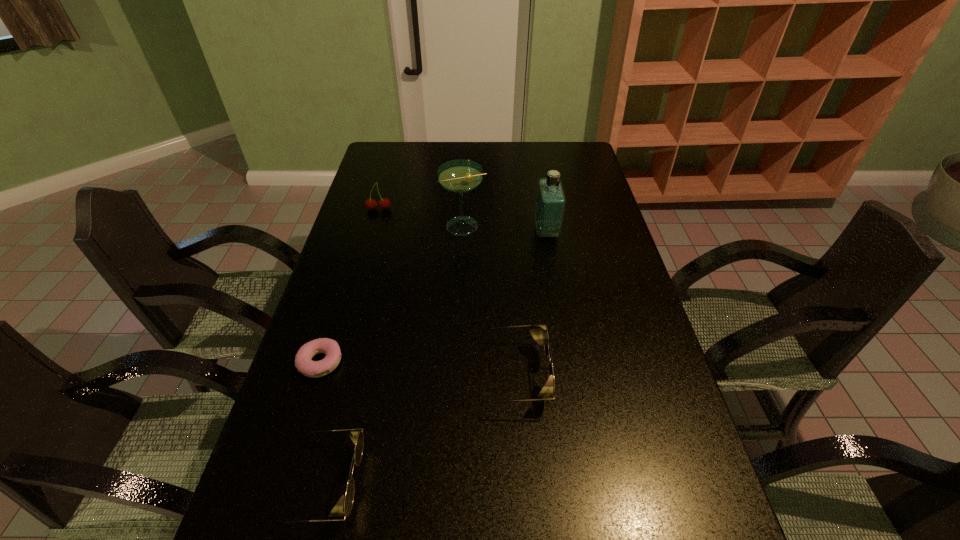
You are a GUI agent. You are given a task and a screenshot of the screen. Output one action in this format:
    pyautogui.click(x=<x>, y=<y>)
    Task: Click on the shorter sunglasses
    
    Given the screenshot: What is the action you would take?
    pyautogui.click(x=356, y=436)

At what (x,y) coordinates should I click in order to perform the action: click on the nearest object. Please return your answer as a coordinate pair (x, y). This screenshot has width=960, height=540. Looking at the image, I should click on (356, 436).

At what (x,y) coordinates should I click in order to perform the action: click on the right sunglasses. Please return your answer as a coordinate pair (x, y). The height and width of the screenshot is (540, 960). Looking at the image, I should click on (547, 393).

Locate an element on the screen. The height and width of the screenshot is (540, 960). the farther sunglasses is located at coordinates click(x=547, y=393).

The image size is (960, 540). What are the coordinates of `the farthest object` in the screenshot? It's located at (384, 203).

Identify the location of perfume. This screenshot has height=540, width=960. (550, 205).

Identify the location of doughnut. The height and width of the screenshot is (540, 960). (303, 363).

Where is `martini`? The image size is (960, 540). martini is located at coordinates (460, 176).

At what (x,y) coordinates should I click in order to perform the action: click on vacant space located 0.330m on the front lenses of the shorter sunglasses. Please return your answer as a coordinate pair (x, y). This screenshot has width=960, height=540. Looking at the image, I should click on click(x=524, y=483).

I want to click on free space located 0.190m on the front lenses of the farther sunglasses, so click(x=625, y=376).